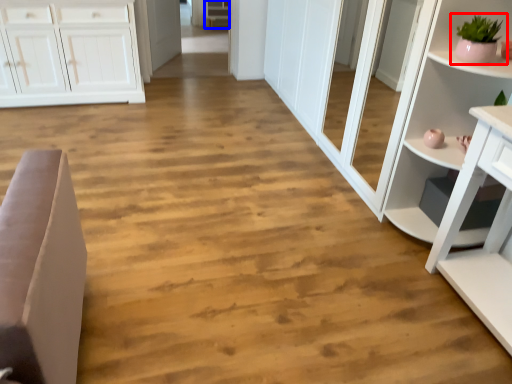
Question: Which object is further to the camera taking this photo, houseplant (highlighted by a red box) or cabinetry (highlighted by a blue box)?

Choices:
 (A) houseplant
 (B) cabinetry

Answer: (B)